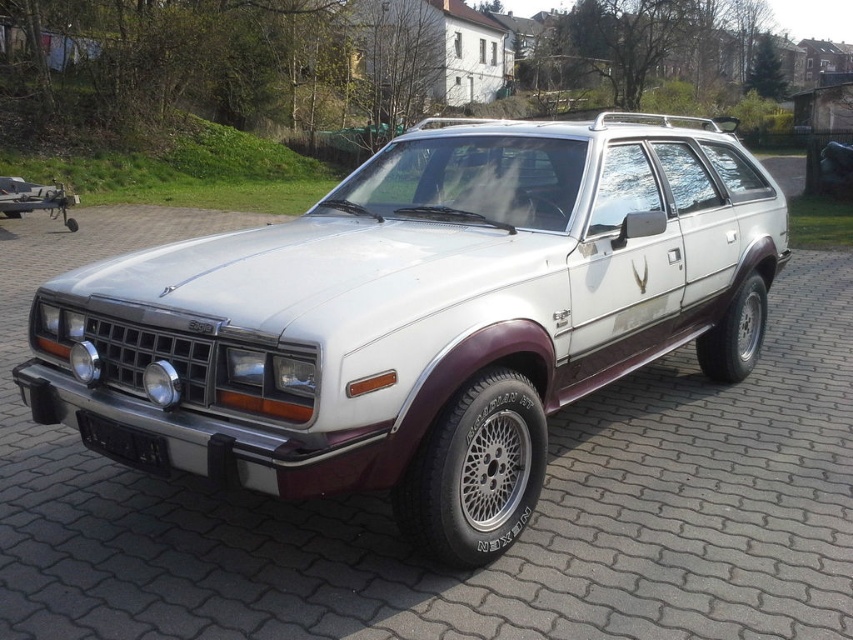
Between point (165, 448) and point (798, 173), which one is positioned behind?

The point (798, 173) is behind.

Measure the distance from black plastic license plate at lower center to gray concrete driveway at center.

39.80 feet

The height and width of the screenshot is (640, 853). Find the location of `black plastic license plate at lower center`. black plastic license plate at lower center is located at coordinates (x=123, y=442).

This screenshot has height=640, width=853. In order to click on black plastic license plate at lower center in this screenshot , I will do [x=123, y=442].

Is white matte station wagon at center wider than black plastic license plate at lower center?

Correct, the width of white matte station wagon at center exceeds that of black plastic license plate at lower center.

Who is higher up, white matte station wagon at center or black plastic license plate at lower center?

white matte station wagon at center

Identify the location of white matte station wagon at center. This screenshot has height=640, width=853. (425, 314).

Between white matte station wagon at center and gray concrete driveway at center, which one is positioned lower?

Positioned lower is white matte station wagon at center.

Is the position of white matte station wagon at center less distant than that of gray concrete driveway at center?

That is True.

Who is more distant from viewer, (602, 292) or (795, 180)?

Positioned behind is point (795, 180).

Where is `white matte station wagon at center`? The image size is (853, 640). white matte station wagon at center is located at coordinates (425, 314).